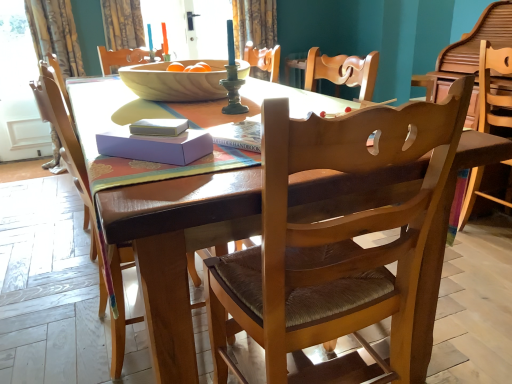
At what (x,y) coordinates should I click in order to perform the action: click on vacant area located to the right-hand side of lavender cardboard box at center. Please return your answer as a coordinate pair (x, y). Looking at the image, I should click on (229, 153).